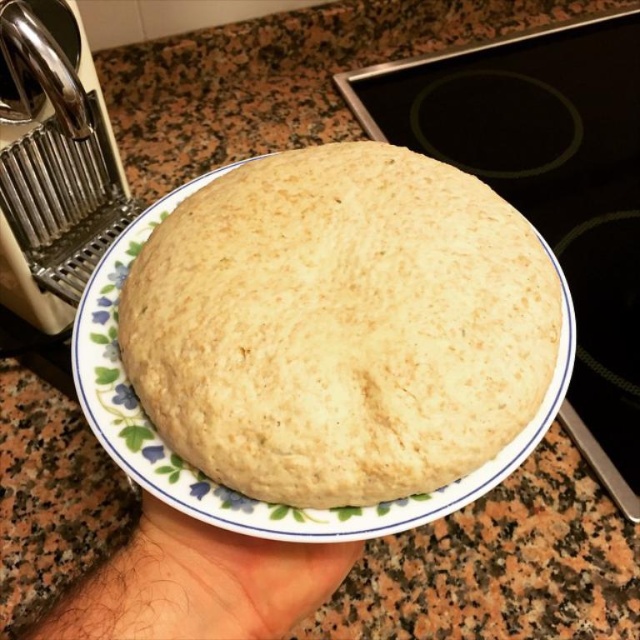
At what (x,y) coordinates should I click in order to perform the action: click on brushed metal pasta machine at upper left. Please return your answer as a coordinate pair (x, y). This screenshot has height=640, width=640. Looking at the image, I should click on (52, 163).

Does brushed metal pasta machine at upper left have a lesser width compared to smooth skin at lower center?

No.

The image size is (640, 640). Identify the location of brushed metal pasta machine at upper left. (52, 163).

Between golden matte bread at center and brushed metal pasta machine at upper left, which one has less height?

golden matte bread at center is shorter.

Between point (243, 285) and point (1, 248), which one is positioned behind?

The point (1, 248) is more distant.

The image size is (640, 640). I want to click on golden matte bread at center, so click(x=340, y=324).

Between point (360, 298) and point (228, 552), which one is positioned in front?

Point (360, 298) is more forward.

Can you confirm if golden matte bread at center is smaller than smooth skin at lower center?

No, golden matte bread at center is not smaller than smooth skin at lower center.

Between point (332, 304) and point (179, 605), which one is positioned behind?

The point (332, 304) is behind.

Where is `golden matte bread at center`? golden matte bread at center is located at coordinates (340, 324).